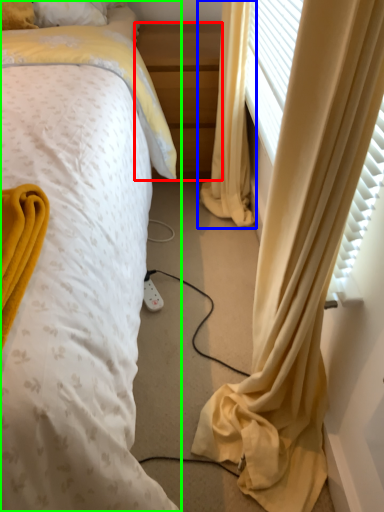
Question: Which object is positioned closest to nightstand (highlighted by a red box)? Select from curtain (highlighted by a blue box) and bed (highlighted by a green box).

Choices:
 (A) curtain
 (B) bed

Answer: (A)